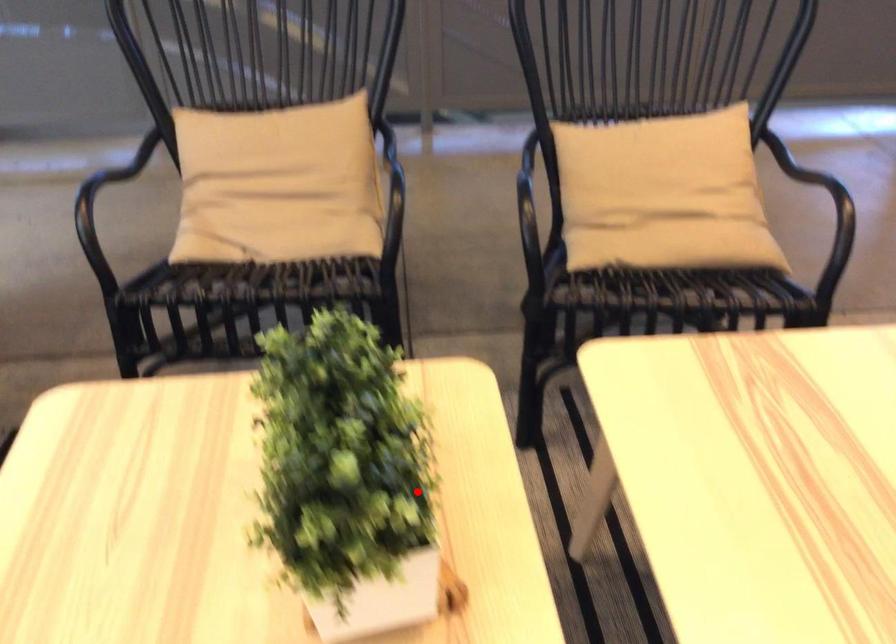
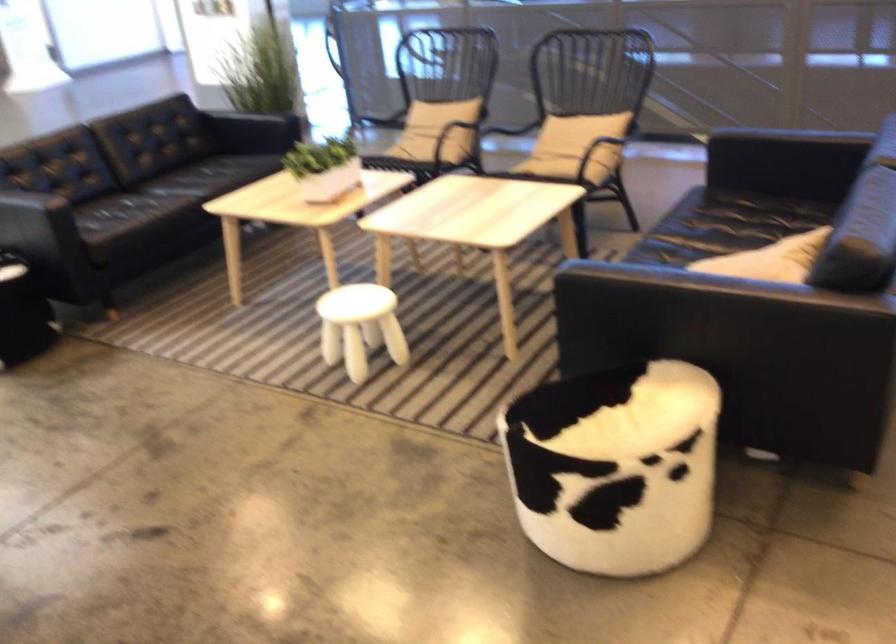
Question: I am providing you with two images of the same scene from different viewpoints. Given a red point in image1, look at the same physical point in image2. Is it:

Choices:
 (A) Closer to the viewpoint
 (B) Farther from the viewpoint

Answer: (B)